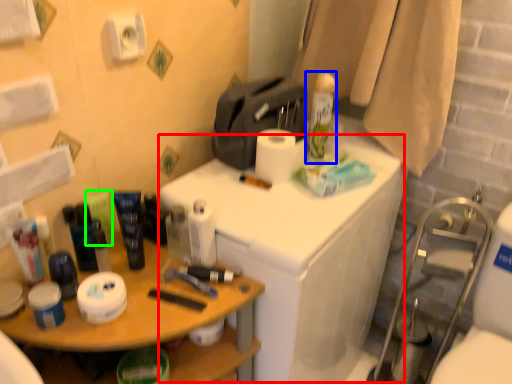
Question: Estimate the real-world distances between objects in this image. Which object is closer to counter (highlighted by a red box), shaving cream (highlighted by a blue box) or toiletry (highlighted by a green box)?

Choices:
 (A) shaving cream
 (B) toiletry

Answer: (A)